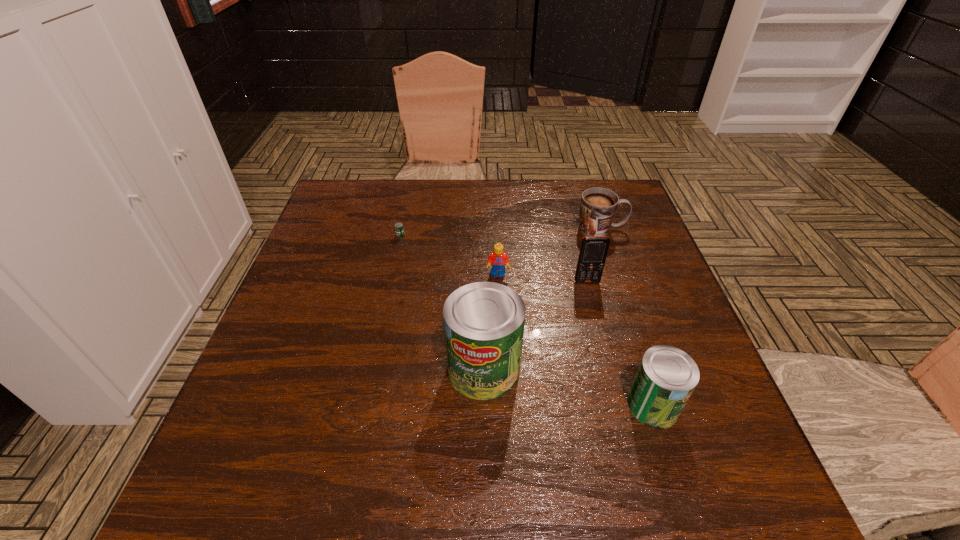
The height and width of the screenshot is (540, 960). What are the coordinates of `the taller can` in the screenshot? It's located at (484, 322).

Where is `the tallest object`? The height and width of the screenshot is (540, 960). the tallest object is located at coordinates (484, 322).

The width and height of the screenshot is (960, 540). Identify the location of the right can. (667, 376).

Image resolution: width=960 pixels, height=540 pixels. I want to click on the shortest object, so click(x=399, y=228).

Find the location of a particular element. This screenshot has width=960, height=540. the leftmost object is located at coordinates (399, 228).

Find the location of a particular element. The width and height of the screenshot is (960, 540). mug is located at coordinates (598, 206).

This screenshot has width=960, height=540. I want to click on the third farthest object, so click(x=498, y=259).

Identify the location of cellular telephone. (593, 251).

The width and height of the screenshot is (960, 540). I want to click on vacant region located 0.060m on the left of the tallest object, so click(x=419, y=369).

Locate an element on the screen. This screenshot has height=540, width=960. vacant region located 0.240m on the back of the right can is located at coordinates (618, 296).